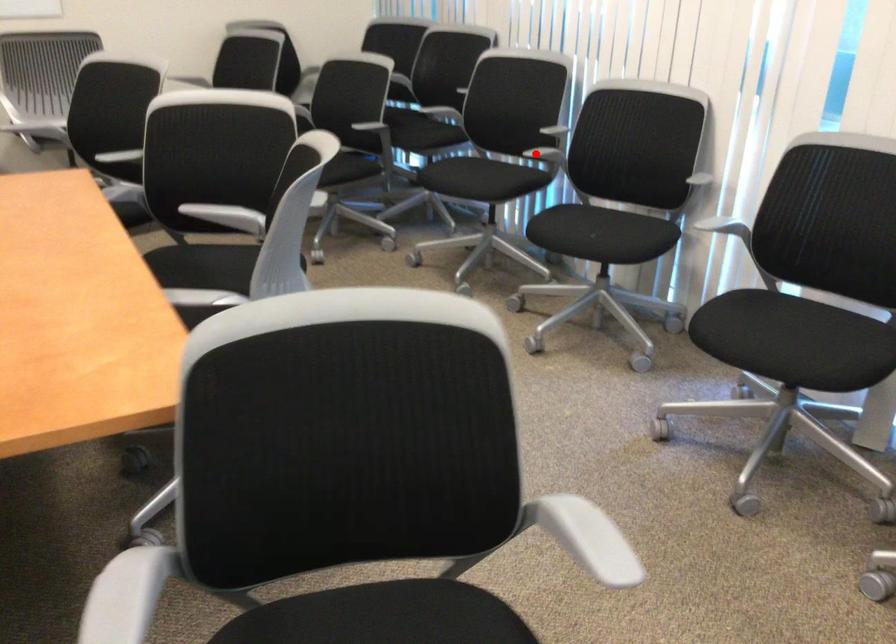
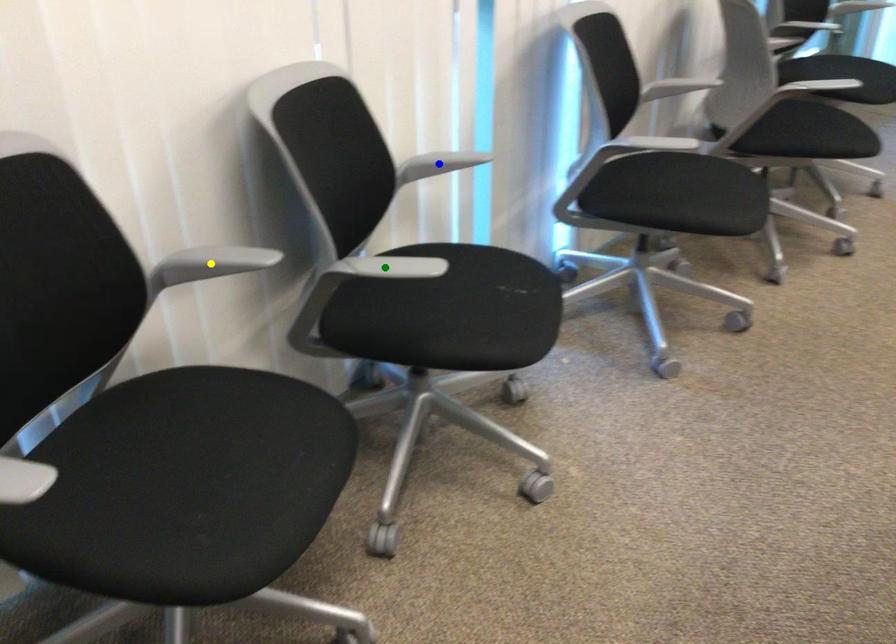
Question: I am providing you with two images of the same scene from different viewpoints. A red point is marked on the first image. You are given multiple points on the second image. Which point in image 2 is actually the same real-world point as the red point in image 1?

Choices:
 (A) yellow point
 (B) blue point
 (C) green point

Answer: (C)